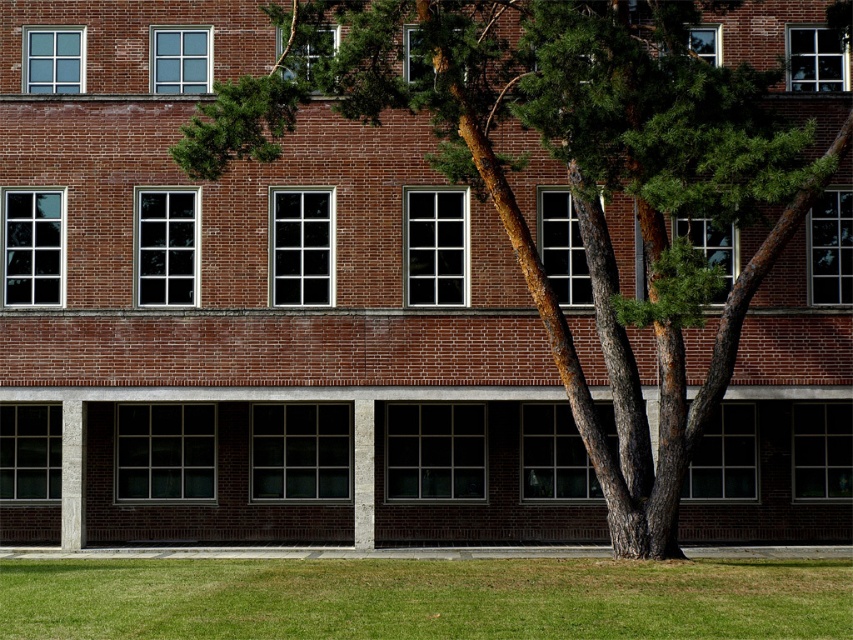
You are standing in front of a brick building and notice two elements in the scene. One is the green textured bark at center and the other is the green grass at lower center. Which of these two elements is taller?

The green textured bark at center is taller than the green grass at lower center.

You are standing in front of the brick building and notice the green textured bark at center and the green grass at lower center. Which of these two elements is positioned higher relative to the other?

The green textured bark at center is above the green grass at lower center.

From the picture: You are a landscape architect designing a garden layout. You need to place a 2 meter wide decorative stone path between the green textured bark at center and the green grass at lower center. Can the path fit between them without overlapping either object?

The green textured bark at center has a lesser width compared to green grass at lower center. The path requires 2 meters of space. Since the green textured bark at center is narrower, the total available space between them may be insufficient. Without exact distance measurements, it is uncertain if the path will fit without overlapping.